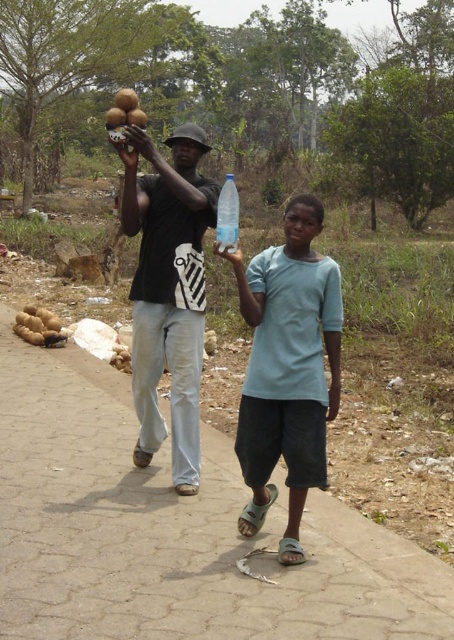
From the picture: Who is taller, matte black coconut at left or light blue cotton shirt at center?

Standing taller between the two is light blue cotton shirt at center.

Is matte black coconut at left in front of light blue cotton shirt at center?

No.

The image size is (454, 640). I want to click on matte black coconut at left, so click(x=287, y=369).

Who is higher up, paved concrete sidewalk at center or transparent plastic bottle at center?

transparent plastic bottle at center is above.

Who is more forward, (360, 554) or (217, 237)?

Positioned in front is point (360, 554).

What are the coordinates of `paved concrete sidewalk at center` in the screenshot? It's located at (172, 531).

Can you confirm if black matte shirt at center is thinner than transparent plastic bottle at center?

No.

Between point (174, 280) and point (218, 246), which one is positioned in front?

Point (218, 246)

Which is behind, point (167, 298) or point (221, 224)?

The point (167, 298) is behind.

Identify the location of black matte shirt at center. The height and width of the screenshot is (640, 454). (167, 291).